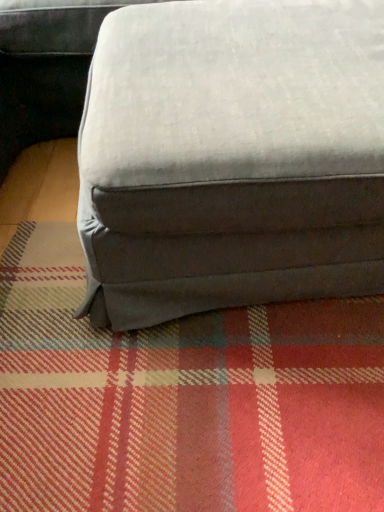
What is the approximate width of textured gray fabric ottoman at center?

textured gray fabric ottoman at center is 25.51 inches in width.

The width and height of the screenshot is (384, 512). Identify the location of textured gray fabric ottoman at center. (231, 157).

The height and width of the screenshot is (512, 384). What do you see at coordinates (231, 157) in the screenshot?
I see `textured gray fabric ottoman at center` at bounding box center [231, 157].

You are a GUI agent. You are given a task and a screenshot of the screen. Output one action in this format:
    pyautogui.click(x=<x>, y=<y>)
    Task: Click on the textured gray fabric ottoman at center
    This screenshot has height=512, width=384.
    Given the screenshot: What is the action you would take?
    pyautogui.click(x=231, y=157)